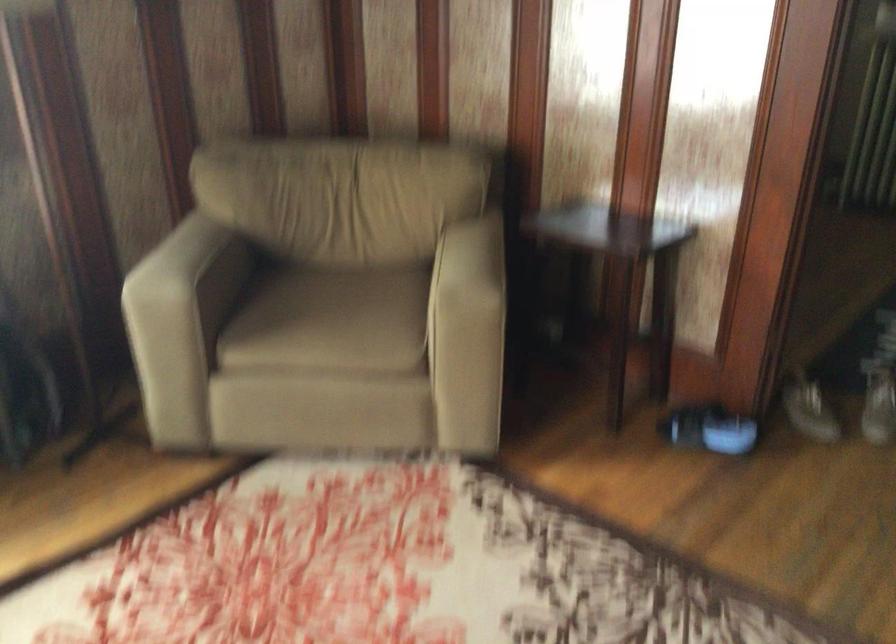
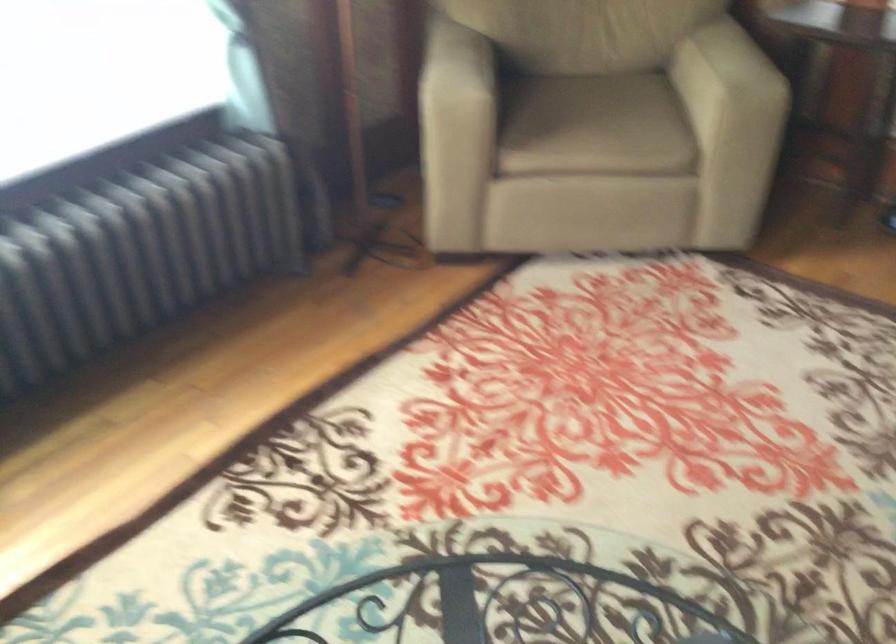
Question: Based on the continuous images, in which direction is the camera rotating? Reply with the corresponding letter.

Choices:
 (A) Left
 (B) Right
 (C) Up
 (D) Down

Answer: (D)